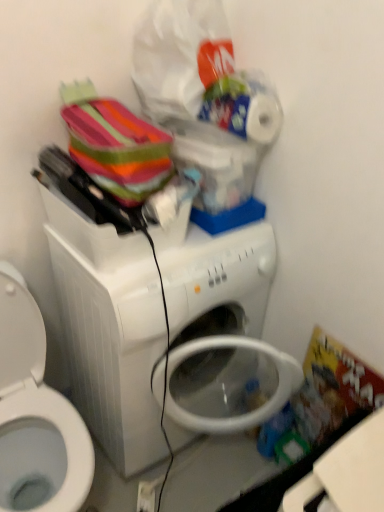
The image size is (384, 512). I want to click on white plastic washing machine at center, so [x=112, y=351].

This screenshot has width=384, height=512. Describe the element at coordinates (112, 351) in the screenshot. I see `white plastic washing machine at center` at that location.

You are a GUI agent. You are given a task and a screenshot of the screen. Output one action in this format:
    pyautogui.click(x=<x>, y=<y>)
    Task: Click on the white plastic washing machine at center
    The width and height of the screenshot is (384, 512).
    Given the screenshot: What is the action you would take?
    pyautogui.click(x=112, y=351)